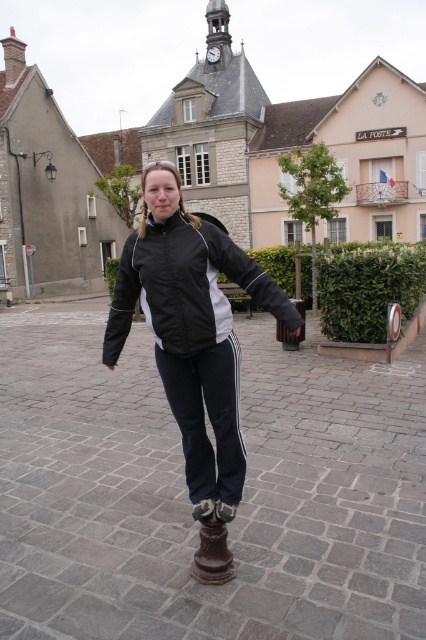
Does point (146, 200) lie behind point (201, 257)?

That is True.

Does black matte jacket at center appear on the right side of black/waterproof jacket at center?

Yes, black matte jacket at center is to the right of black/waterproof jacket at center.

Who is more distant from viewer, [127,321] or [140,253]?

Point [127,321]

This screenshot has height=640, width=426. Identify the location of black matte jacket at center. (192, 330).